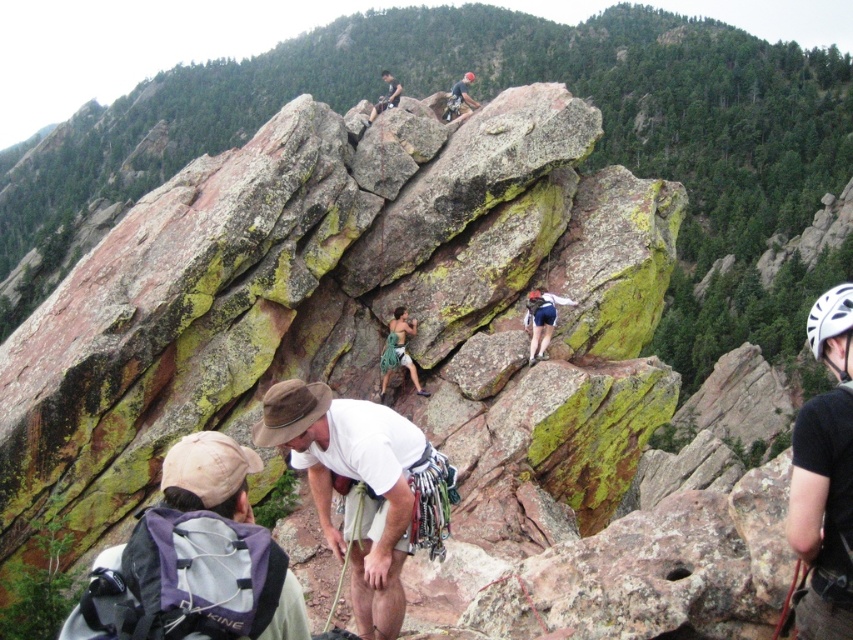
You are a photographer standing at the base of the cliff. You want to take a photo of the black mesh helmet at upper right but your camera has a maximum range of 15 meters. Can you capture the helmet in your photo?

The black mesh helmet at upper right and camera are 17.54 meters apart from each other, which exceeds the camera maximum range of 15 meters. Therefore, the photographer cannot capture the helmet in the photo.

You are a photographer positioned at the base of the cliff. You want to capture a photo that includes both the gray fabric backpack at lower left and the black mesh helmet at upper right. Which object should you focus on first if you want to ensure both are in the frame without moving the camera?

The gray fabric backpack at lower left is shorter than the black mesh helmet at upper right. To include both in the frame without moving the camera, focus on the gray fabric backpack at lower left first since it is closer to the camera, ensuring it remains in the foreground while the helmet stays in the background.

You are a climber looking at the cliff face. There are two points marked on the rock formation. The first point is at coordinate point [828,580] and the second is at point [467,99]. Which point is closer to your current position as you stand at the base of the cliff?

Point [828,580] is closer to the camera than point [467,99], so the first point is closer to your current position at the base of the cliff.